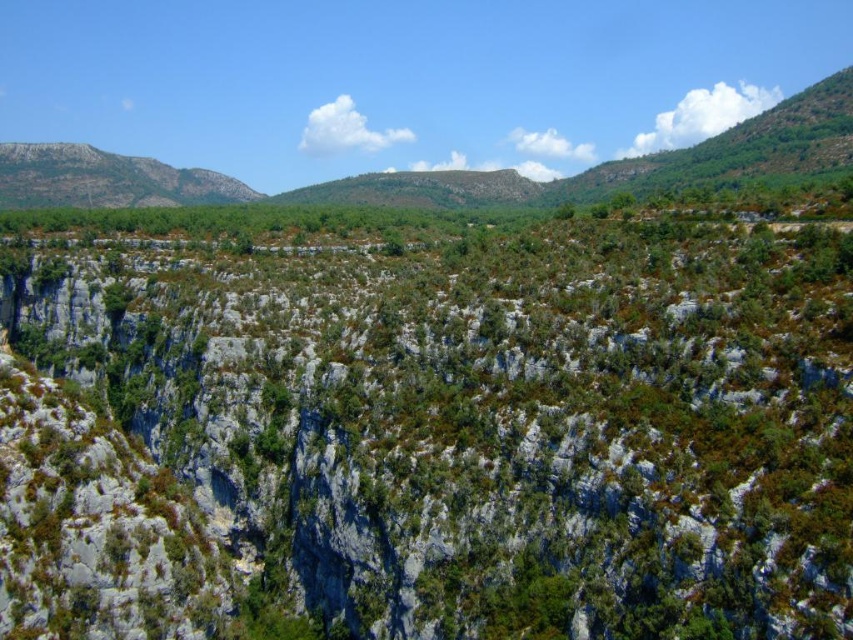
Question: Can you confirm if green leafy shrub at center is bigger than gray rocky mountain at upper left?

Choices:
 (A) no
 (B) yes

Answer: (A)

Question: Which point is farther to the camera?

Choices:
 (A) (247, 508)
 (B) (0, 154)

Answer: (B)

Question: Which of the following is the farthest from the observer?

Choices:
 (A) (444, 614)
 (B) (35, 172)

Answer: (B)

Question: Is green leafy shrub at center to the left of gray rocky mountain at upper left from the viewer's perspective?

Choices:
 (A) no
 (B) yes

Answer: (A)

Question: Which object is closer to the camera taking this photo?

Choices:
 (A) gray rocky mountain at upper left
 (B) green leafy shrub at center

Answer: (B)

Question: Does green leafy shrub at center have a smaller size compared to gray rocky mountain at upper left?

Choices:
 (A) no
 (B) yes

Answer: (B)